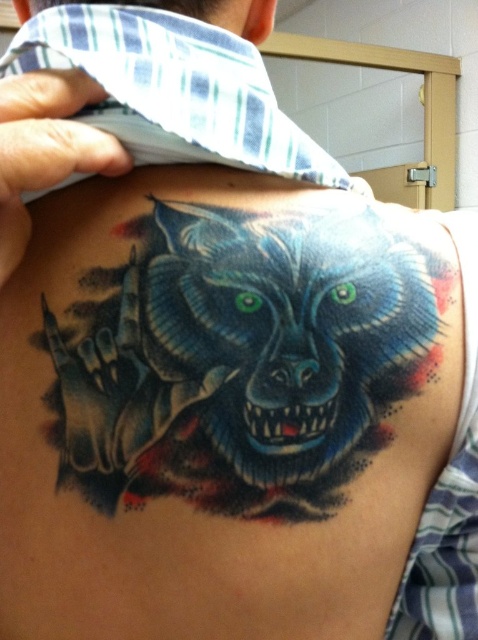
Question: Can you confirm if colorful ink wolf at upper right is wider than matte blue neck at upper center?

Choices:
 (A) no
 (B) yes

Answer: (B)

Question: Which object appears farthest from the camera in this image?

Choices:
 (A) matte blue neck at upper center
 (B) colorful ink wolf at upper right
 (C) blue plaid tie at upper left

Answer: (A)

Question: Can you confirm if colorful ink wolf at upper right is wider than blue plaid tie at upper left?

Choices:
 (A) no
 (B) yes

Answer: (B)

Question: Based on their relative distances, which object is nearer to the blue plaid tie at upper left?

Choices:
 (A) colorful ink wolf at upper right
 (B) matte blue neck at upper center

Answer: (B)

Question: Can you confirm if blue plaid tie at upper left is thinner than matte blue neck at upper center?

Choices:
 (A) no
 (B) yes

Answer: (A)

Question: Which of the following is the farthest from the observer?

Choices:
 (A) blue plaid tie at upper left
 (B) matte blue neck at upper center

Answer: (B)